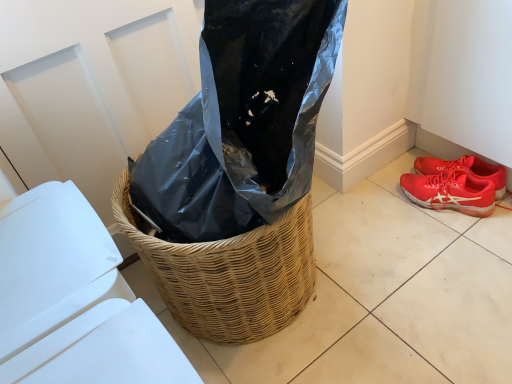
This screenshot has width=512, height=384. I want to click on white plastic lid at lower left, so click(74, 300).

What is the approximate width of shiny red sneakers at lower right, acting as the 2th footwear starting from the top?

shiny red sneakers at lower right, acting as the 2th footwear starting from the top, is 5.06 inches wide.

At what (x,y) coordinates should I click in order to perform the action: click on white plastic lid at lower left. Please return your answer as a coordinate pair (x, y). This screenshot has height=384, width=512. Looking at the image, I should click on (74, 300).

From a real-world perspective, is white plastic lid at lower left below red mesh shoe at lower right, which is the 1th footwear in top-to-bottom order?

No, from a real-world perspective, white plastic lid at lower left is not below red mesh shoe at lower right, which is the 1th footwear in top-to-bottom order.

Is point (106, 243) farther from viewer compared to point (498, 186)?

No, it is in front of (498, 186).

How far apart are white plastic lid at lower left and red mesh shoe at lower right, the 2th footwear positioned from the bottom?

1.18 meters.

You are a GUI agent. You are given a task and a screenshot of the screen. Output one action in this format:
    pyautogui.click(x=<x>, y=<y>)
    Task: Click on the 1st footwear directly beneath the white plastic lid at lower left (from a real-world perspective)
    
    Given the screenshot: What is the action you would take?
    pyautogui.click(x=465, y=169)

Is red mesh shoe at lower right, the 2th footwear positioned from the bottom, oriented away from white plastic lid at lower left?

No, red mesh shoe at lower right, the 2th footwear positioned from the bottom, is not facing the opposite direction of white plastic lid at lower left.

Considering the sizes of red mesh shoe at lower right, which is the 1th footwear in top-to-bottom order, and white plastic lid at lower left in the image, is red mesh shoe at lower right, which is the 1th footwear in top-to-bottom order, taller or shorter than white plastic lid at lower left?

In the image, red mesh shoe at lower right, which is the 1th footwear in top-to-bottom order, appears to be shorter than white plastic lid at lower left.

How much distance is there between red mesh shoe at lower right, which is the 1th footwear in top-to-bottom order, and white plastic lid at lower left?

They are 3.87 feet apart.

Which point is more distant from viewer, (481, 169) or (440, 190)?

The point (440, 190) is farther from the camera.

Which of these two, red mesh shoe at lower right, which is the 1th footwear in top-to-bottom order, or shiny red sneakers at lower right, acting as the 2th footwear starting from the top, is thinner?

Thinner between the two is red mesh shoe at lower right, which is the 1th footwear in top-to-bottom order.

From the picture: Who is more distant, red mesh shoe at lower right, which is the 1th footwear in top-to-bottom order, or shiny red sneakers at lower right, which is the first footwear in bottom-to-top order?

red mesh shoe at lower right, which is the 1th footwear in top-to-bottom order, is further away from the camera.

What's the angular difference between red mesh shoe at lower right, the 2th footwear positioned from the bottom, and shiny red sneakers at lower right, which is the first footwear in bottom-to-top order,'s facing directions?

The facing directions of red mesh shoe at lower right, the 2th footwear positioned from the bottom, and shiny red sneakers at lower right, which is the first footwear in bottom-to-top order, are 2.78 degrees apart.

Considering the sizes of objects shiny red sneakers at lower right, which is the first footwear in bottom-to-top order, and white plastic lid at lower left in the image provided, who is smaller, shiny red sneakers at lower right, which is the first footwear in bottom-to-top order, or white plastic lid at lower left?

With smaller size is shiny red sneakers at lower right, which is the first footwear in bottom-to-top order.

Is shiny red sneakers at lower right, which is the first footwear in bottom-to-top order, to the right of white plastic lid at lower left from the viewer's perspective?

Correct, you'll find shiny red sneakers at lower right, which is the first footwear in bottom-to-top order, to the right of white plastic lid at lower left.

Is shiny red sneakers at lower right, which is the first footwear in bottom-to-top order, taller or shorter than white plastic lid at lower left?

Considering their sizes, shiny red sneakers at lower right, which is the first footwear in bottom-to-top order, has less height than white plastic lid at lower left.

Which is closer to the camera, (413, 182) or (76, 295)?

The point (76, 295) is closer.

From the image's perspective, which is below, shiny red sneakers at lower right, which is the first footwear in bottom-to-top order, or red mesh shoe at lower right, the 2th footwear positioned from the bottom?

shiny red sneakers at lower right, which is the first footwear in bottom-to-top order, appears lower in the image.

Is shiny red sneakers at lower right, which is the first footwear in bottom-to-top order, to the left of red mesh shoe at lower right, which is the 1th footwear in top-to-bottom order, from the viewer's perspective?

Yes.

Is shiny red sneakers at lower right, acting as the 2th footwear starting from the top, facing towards red mesh shoe at lower right, the 2th footwear positioned from the bottom?

Yes, shiny red sneakers at lower right, acting as the 2th footwear starting from the top, is oriented towards red mesh shoe at lower right, the 2th footwear positioned from the bottom.

Considering the sizes of objects white plastic lid at lower left and shiny red sneakers at lower right, acting as the 2th footwear starting from the top, in the image provided, who is smaller, white plastic lid at lower left or shiny red sneakers at lower right, acting as the 2th footwear starting from the top,?

shiny red sneakers at lower right, acting as the 2th footwear starting from the top, is smaller.

The width and height of the screenshot is (512, 384). Identify the location of the 1st footwear behind the white plastic lid at lower left, starting your count from the anchor. (451, 191).

Measure the distance from white plastic lid at lower left to shiny red sneakers at lower right, acting as the 2th footwear starting from the top.

They are 3.63 feet apart.

Is white plastic lid at lower left not within shiny red sneakers at lower right, which is the first footwear in bottom-to-top order?

Yes, white plastic lid at lower left is not within shiny red sneakers at lower right, which is the first footwear in bottom-to-top order.

Where is `the 2nd footwear behind the white plastic lid at lower left, counting from the anchor's position`? the 2nd footwear behind the white plastic lid at lower left, counting from the anchor's position is located at coordinates (465, 169).

This screenshot has height=384, width=512. I want to click on footwear that is the 1st one below the white plastic lid at lower left (from a real-world perspective), so click(465, 169).

Based on their spatial positions, is white plastic lid at lower left or red mesh shoe at lower right, the 2th footwear positioned from the bottom, closer to shiny red sneakers at lower right, which is the first footwear in bottom-to-top order?

red mesh shoe at lower right, the 2th footwear positioned from the bottom.

Which object lies nearer to the anchor point white plastic lid at lower left, shiny red sneakers at lower right, acting as the 2th footwear starting from the top, or red mesh shoe at lower right, the 2th footwear positioned from the bottom?

shiny red sneakers at lower right, acting as the 2th footwear starting from the top.

When comparing their distances from shiny red sneakers at lower right, which is the first footwear in bottom-to-top order, does red mesh shoe at lower right, which is the 1th footwear in top-to-bottom order, or white plastic lid at lower left seem further?

white plastic lid at lower left is positioned further to the anchor shiny red sneakers at lower right, which is the first footwear in bottom-to-top order.

Looking at the image, which one is located closer to red mesh shoe at lower right, the 2th footwear positioned from the bottom, shiny red sneakers at lower right, acting as the 2th footwear starting from the top, or white plastic lid at lower left?

Among the two, shiny red sneakers at lower right, acting as the 2th footwear starting from the top, is located nearer to red mesh shoe at lower right, the 2th footwear positioned from the bottom.

Which object lies further to the anchor point white plastic lid at lower left, red mesh shoe at lower right, which is the 1th footwear in top-to-bottom order, or shiny red sneakers at lower right, which is the first footwear in bottom-to-top order?

Among the two, red mesh shoe at lower right, which is the 1th footwear in top-to-bottom order, is located further to white plastic lid at lower left.

Considering their positions, is white plastic lid at lower left positioned closer to red mesh shoe at lower right, which is the 1th footwear in top-to-bottom order, than shiny red sneakers at lower right, which is the first footwear in bottom-to-top order?

The object closer to red mesh shoe at lower right, which is the 1th footwear in top-to-bottom order, is shiny red sneakers at lower right, which is the first footwear in bottom-to-top order.

Find the location of a particular element. footwear between white plastic lid at lower left and red mesh shoe at lower right, which is the 1th footwear in top-to-bottom order, in the horizontal direction is located at coordinates (451, 191).